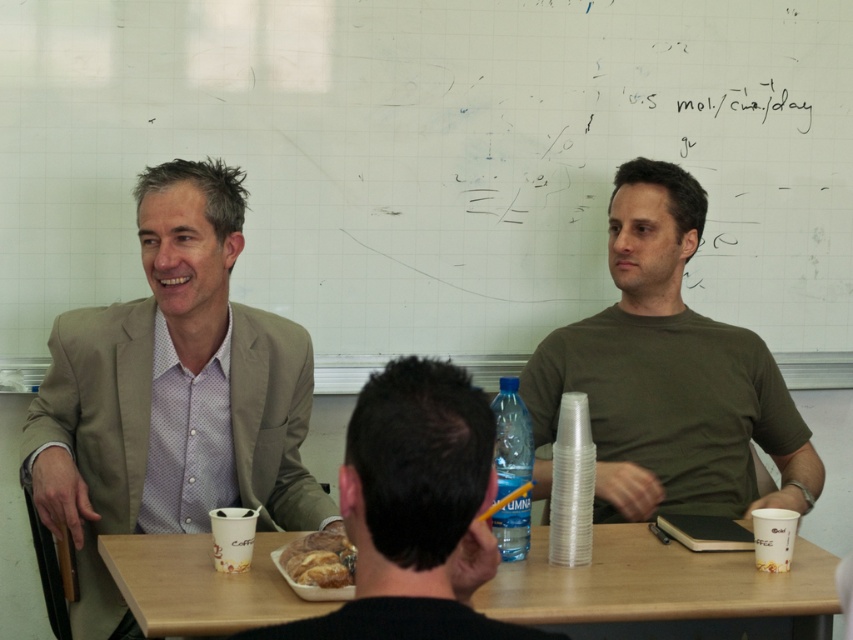
Question: Observing the image, what is the correct spatial positioning of light brown suit at left in reference to green matte t-shirt at right?

Choices:
 (A) below
 (B) above

Answer: (A)

Question: In this image, where is light brown suit at left located relative to green matte t-shirt at right?

Choices:
 (A) above
 (B) below

Answer: (B)

Question: Which point appears farthest from the camera in this image?

Choices:
 (A) (328, 556)
 (B) (672, 173)

Answer: (B)

Question: Among these points, which one is nearest to the camera?

Choices:
 (A) (366, 616)
 (B) (634, 531)

Answer: (A)

Question: Does light brown suit at left have a lesser width compared to golden brown crusty bread at center?

Choices:
 (A) no
 (B) yes

Answer: (A)

Question: Based on their relative distances, which object is farther from the light brown suit at left?

Choices:
 (A) golden brown crusty bread at center
 (B) wooden table at center
 (C) green matte t-shirt at right
 (D) black matte shirt at center

Answer: (C)